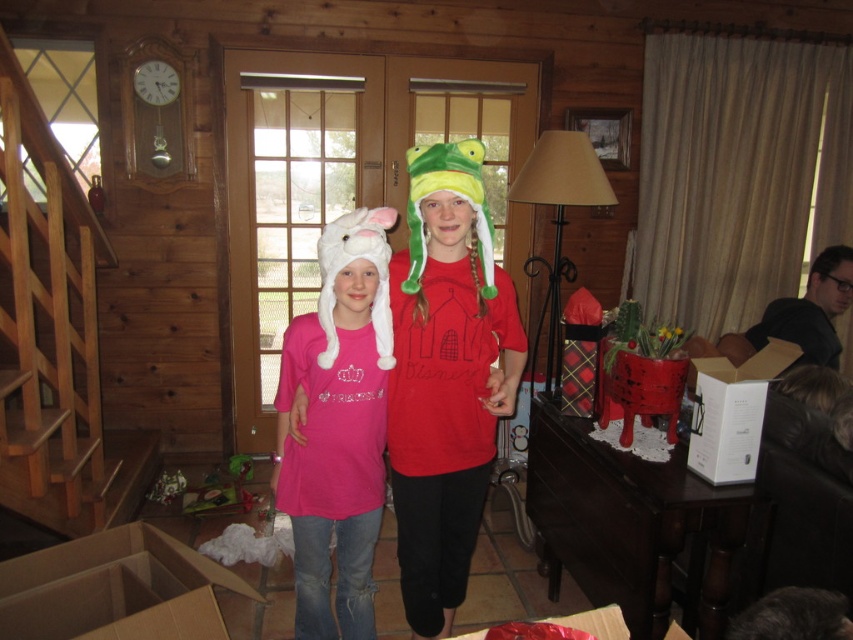
In the scene shown: You are standing in the living room of a wooden cabin and see the cardboard box at lower left. If you want to place a new decorative item exactly where the cardboard box is located, what coordinates should you use?

The coordinates for the cardboard box at lower left are at point [115,589], so you should place the new decorative item at those coordinates.

You are a parent trying to hand a gift to your child. The gift is placed in the white cardboard box at right. Your child is wearing the pink fabric shirt at center. If you are standing at the center of the room, can you reach the box without moving? The maximum reaching distance is 1 meter.

The distance between the pink fabric shirt at center and the white cardboard box at right is 94.75 centimeters, which is within the 1 meter maximum reaching distance. Therefore, you can reach the box without moving.

You are a parent trying to choose a hat for your child from the two available in the living room. The matte green plush hat at center and the white fluffy hat at left are both options. Based on their sizes, which hat would you recommend if you want a wider one?

The matte green plush hat at center has a larger width than the white fluffy hat at left, so it would be the better choice for a wider option.